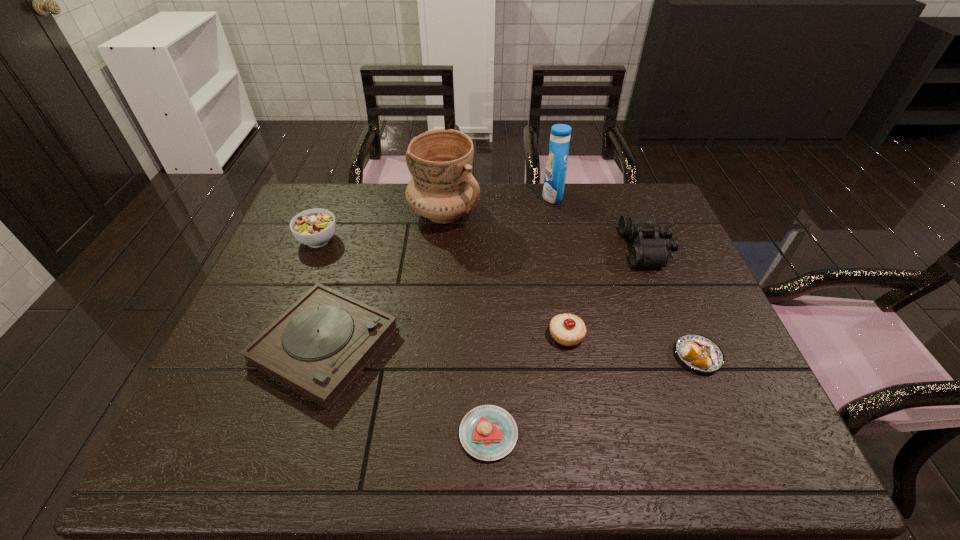
Find the location of `free spot that satisfies the following two spatial constraints: 1. at the eyepieces of the binoculars; 2. on the right side of the rightmost pastry`. free spot that satisfies the following two spatial constraints: 1. at the eyepieces of the binoculars; 2. on the right side of the rightmost pastry is located at coordinates (690, 356).